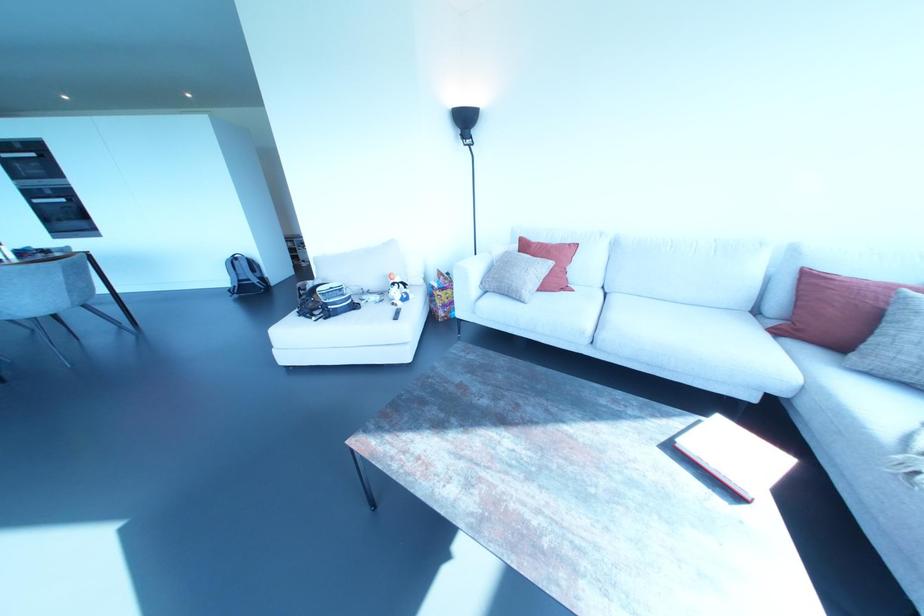
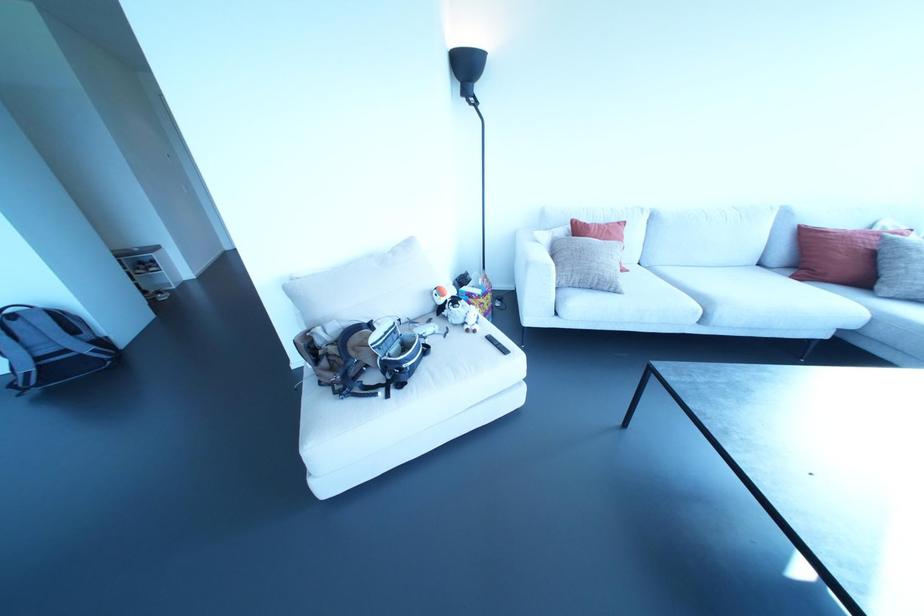
In the second image, find the point that corresponds to (x=395, y=317) in the first image.

(504, 351)